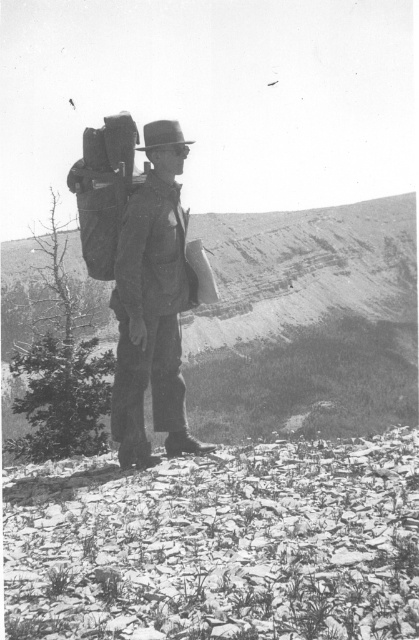
Question: Does smooth dirt hillside at center have a smaller size compared to rugged canvas backpack at center?

Choices:
 (A) no
 (B) yes

Answer: (A)

Question: Which point appears closest to the camera in this image?

Choices:
 (A) (155, 429)
 (B) (258, 356)

Answer: (A)

Question: From the image, what is the correct spatial relationship of smooth dirt hillside at center in relation to rugged canvas backpack at center?

Choices:
 (A) right
 (B) left

Answer: (A)

Question: Which object is farther from the camera taking this photo?

Choices:
 (A) smooth dirt hillside at center
 (B) rugged canvas backpack at center

Answer: (A)

Question: Can you confirm if smooth dirt hillside at center is bigger than rugged canvas backpack at center?

Choices:
 (A) no
 (B) yes

Answer: (B)

Question: Which point appears closest to the camera in this image?

Choices:
 (A) (403, 209)
 (B) (178, 445)

Answer: (B)